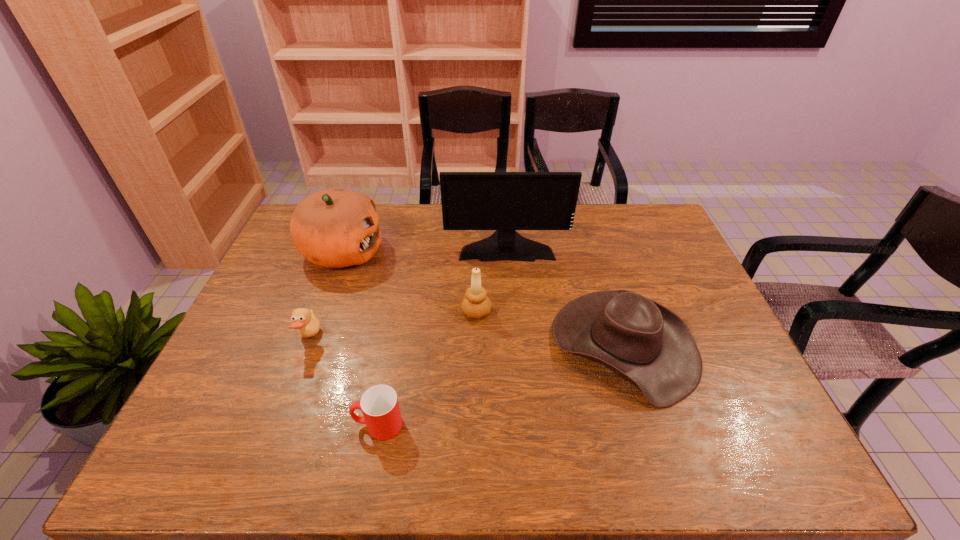
Find the location of a particular element. Image resolution: width=960 pixels, height=540 pixels. vacant point located on the back of the cowboy hat is located at coordinates (596, 253).

Locate an element on the screen. free space located on the beak of the duck is located at coordinates (464, 338).

Find the location of `free space located on the side of the fourth object from right to left with the handle`. free space located on the side of the fourth object from right to left with the handle is located at coordinates (332, 425).

Where is `vacant space located on the side of the fourth object from right to left with the handle`? Image resolution: width=960 pixels, height=540 pixels. vacant space located on the side of the fourth object from right to left with the handle is located at coordinates pyautogui.click(x=201, y=425).

This screenshot has width=960, height=540. In order to click on free space located on the side of the fourth object from right to left with the handle in this screenshot , I will do `click(279, 425)`.

At what (x,y) coordinates should I click in order to perform the action: click on monitor present at the far edge. Please return your answer as a coordinate pair (x, y). Looking at the image, I should click on (503, 201).

Where is `pumpkin situated at the far edge`? pumpkin situated at the far edge is located at coordinates (333, 228).

The width and height of the screenshot is (960, 540). Identify the location of object that is at the near edge. (379, 404).

You are a GUI agent. You are given a task and a screenshot of the screen. Output one action in this format:
    pyautogui.click(x=<x>, y=<y>)
    Task: Click on the object situated at the left edge
    
    Given the screenshot: What is the action you would take?
    pyautogui.click(x=333, y=228)

Locate an element on the screen. This screenshot has height=540, width=960. object that is at the right edge is located at coordinates (645, 343).